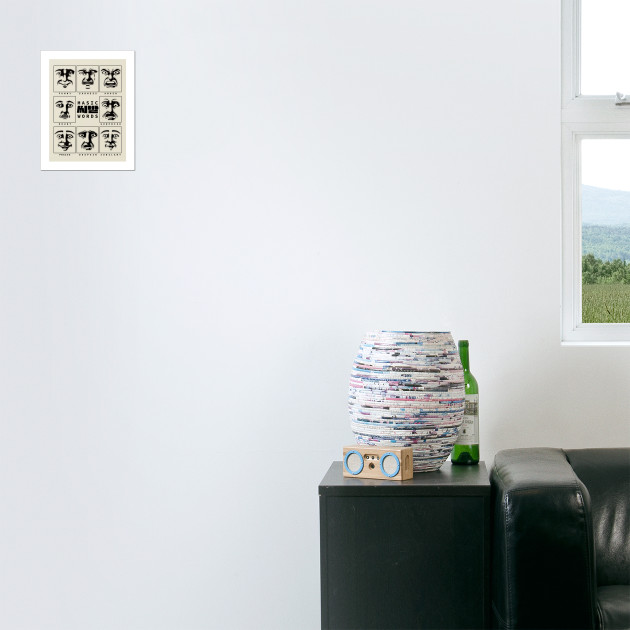
Pinpoint the coordinates of where i would sit on the sofa in the image. Your answer should be formatted as a list of tuples, i.e. [(x1, y1), (x2, y2), ...], where each tuple contains the x and y coordinates of a point satisfying the conditions above.

[(620, 609)]